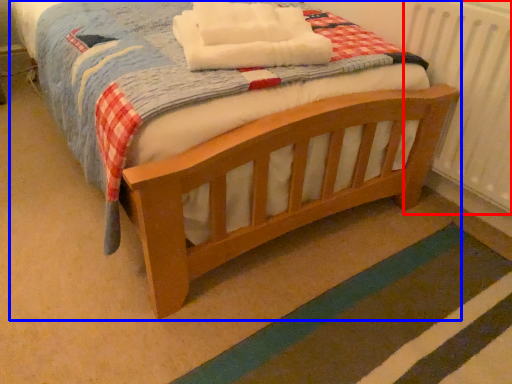
Question: Which object appears closest to the camera in this image, radiator (highlighted by a red box) or bed (highlighted by a blue box)?

Choices:
 (A) radiator
 (B) bed

Answer: (B)